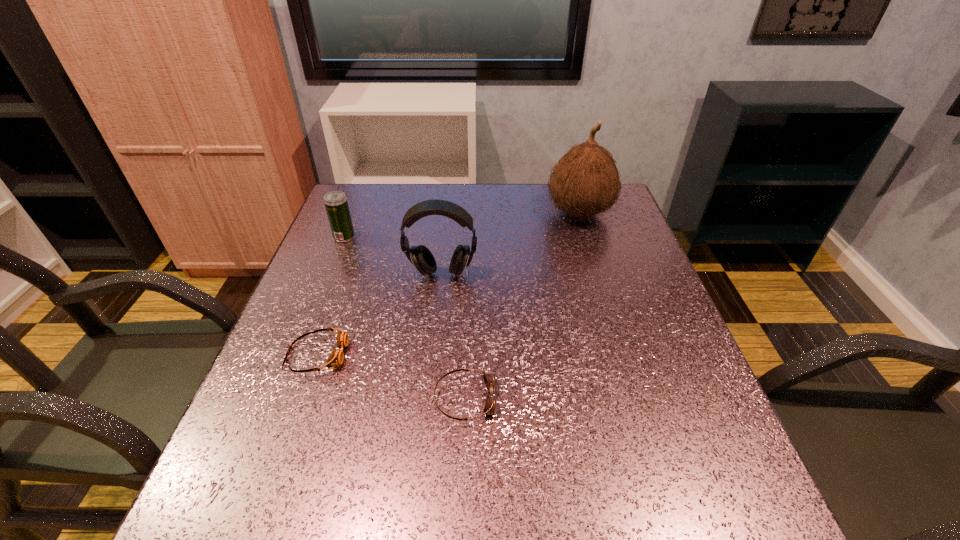
Find the location of a particular element. The height and width of the screenshot is (540, 960). vacant point located between the third shortest object and the earphone is located at coordinates (393, 255).

You are a GUI agent. You are given a task and a screenshot of the screen. Output one action in this format:
    pyautogui.click(x=<x>, y=<y>)
    Task: Click on the free area in between the third nearest object and the coconut
    
    Given the screenshot: What is the action you would take?
    click(x=511, y=244)

Find the location of a particular element. object that can be found as the second closest to the left goggles is located at coordinates (490, 407).

Locate which object ranks third in proximity to the third farthest object. Please provide its 2D coordinates. Your answer should be formatted as a tuple, i.e. [(x, y)], where the tuple contains the x and y coordinates of a point satisfying the conditions above.

[(585, 182)]

Where is `free location that satisfies the following two spatial constraints: 1. on the surface of the coconut; 2. on the ear cups of the fourth shortest object`? This screenshot has height=540, width=960. free location that satisfies the following two spatial constraints: 1. on the surface of the coconut; 2. on the ear cups of the fourth shortest object is located at coordinates (598, 274).

Identify the location of vacant region that satisfies the following two spatial constraints: 1. on the ear cups of the second tallest object; 2. with the lenses facing forward on the left goggles. The image size is (960, 540). (433, 354).